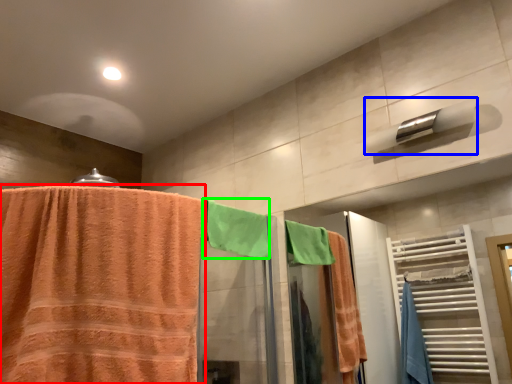
Question: Which is farther away from towel (highlighted by a red box)? towel bar (highlighted by a blue box) or beach towel (highlighted by a green box)?

Choices:
 (A) towel bar
 (B) beach towel

Answer: (A)